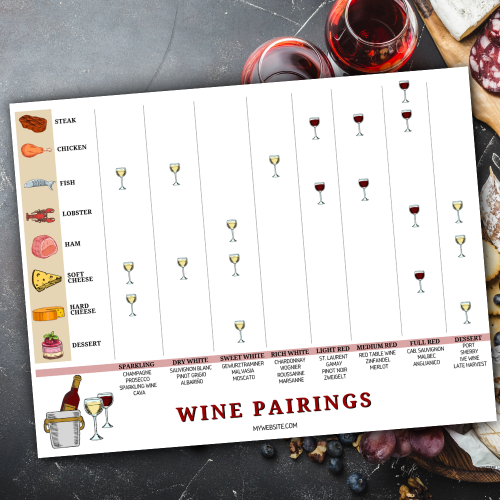
Locate an element on the screen. Image resolution: width=500 pixels, height=500 pixels. wine glasses is located at coordinates (313, 61), (385, 16).